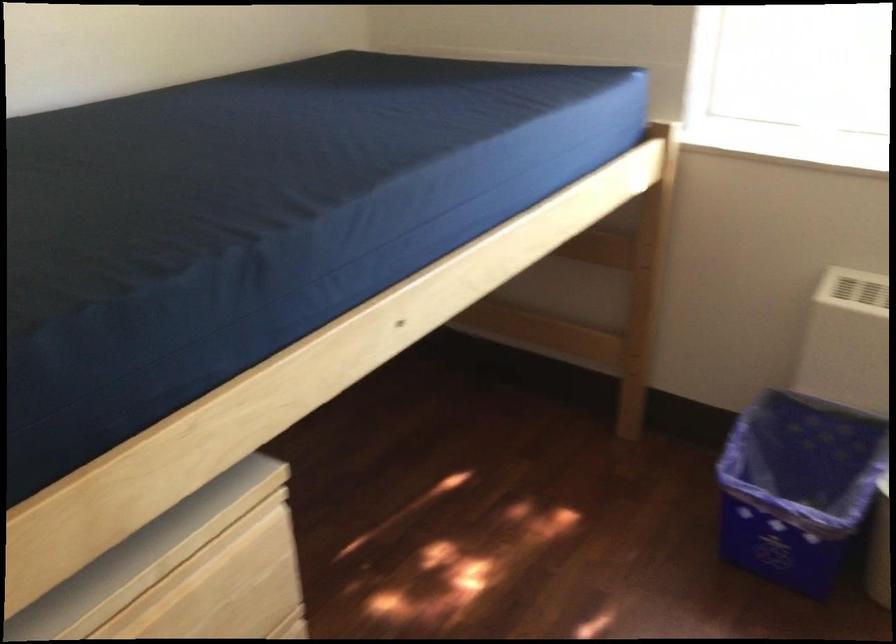
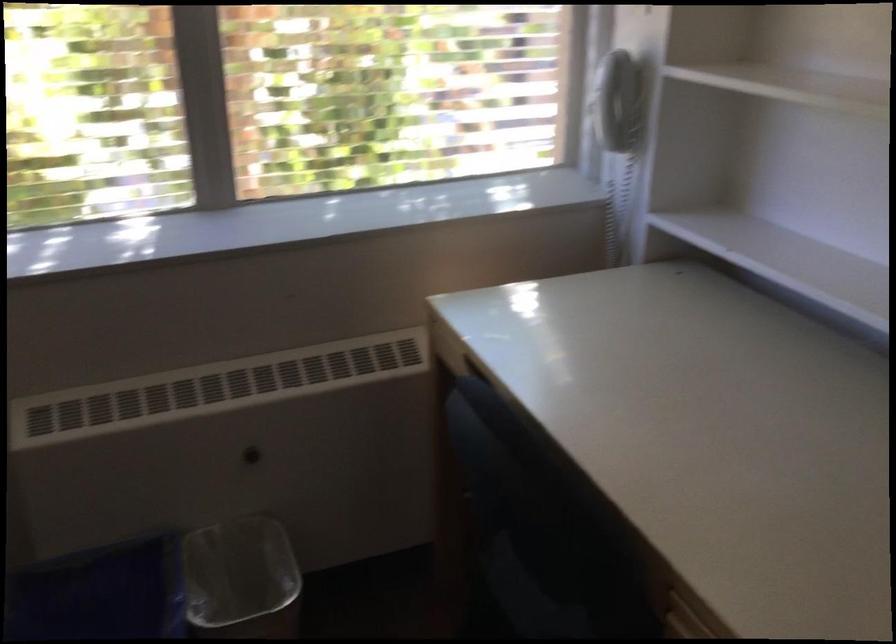
Question: The first image is from the beginning of the video and the second image is from the end. How did the camera likely rotate when shooting the video?

Choices:
 (A) Left
 (B) Right
 (C) Up
 (D) Down

Answer: (B)